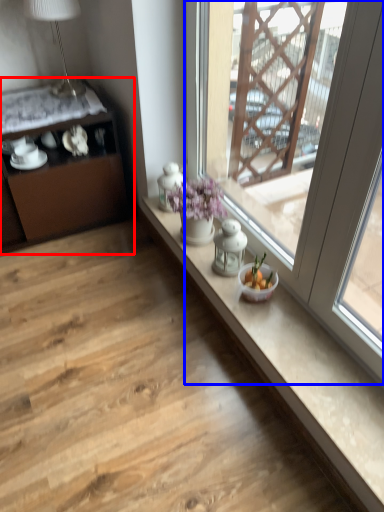
Question: Which object appears farthest to the camera in this image, cabinetry (highlighted by a red box) or window (highlighted by a blue box)?

Choices:
 (A) cabinetry
 (B) window

Answer: (A)